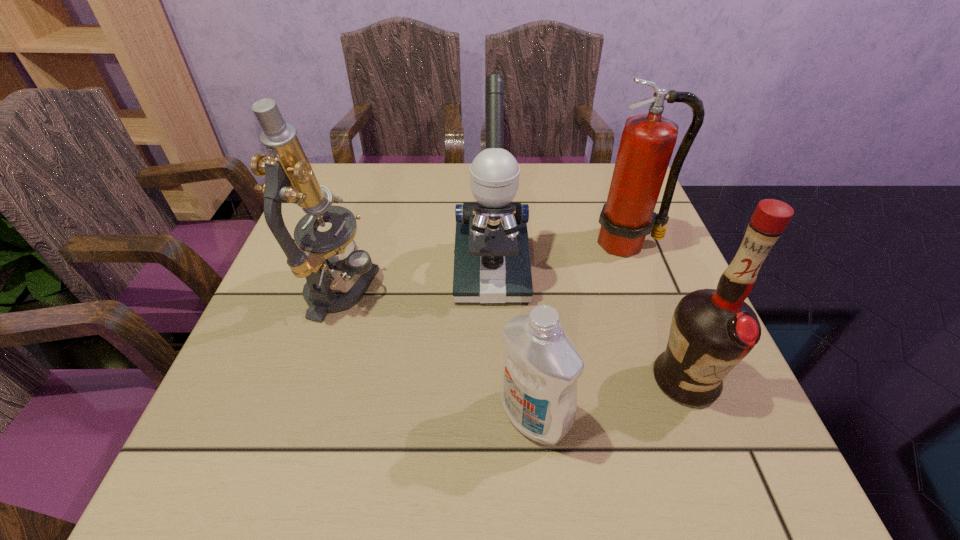
You are a GUI agent. You are given a task and a screenshot of the screen. Output one action in this format:
    pyautogui.click(x=<x>, y=<y>)
    Task: Click on the leftmost object
    This screenshot has width=960, height=540.
    Given the screenshot: What is the action you would take?
    pyautogui.click(x=315, y=255)

Where is `the right microscope`? This screenshot has width=960, height=540. the right microscope is located at coordinates (492, 265).

Where is `fire extinguisher`? The image size is (960, 540). fire extinguisher is located at coordinates (648, 140).

The width and height of the screenshot is (960, 540). What are the coordinates of `liquor` in the screenshot? It's located at 712,330.

Where is `detergent`? detergent is located at coordinates (541, 365).

What are the coordinates of `free location located on the right of the left microscope` in the screenshot? It's located at (485, 291).

Locate an element on the screen. This screenshot has height=540, width=960. free point located at the eyepiece of the right microscope is located at coordinates (492, 326).

The image size is (960, 540). I want to click on vacant space situated at the nozzle of the fire extinguisher, so click(679, 381).

Identify the location of free space located on the front and back of the liquor. This screenshot has width=960, height=540. (726, 487).

Image resolution: width=960 pixels, height=540 pixels. I want to click on free space located 0.310m on the left of the shortest object, so click(306, 416).